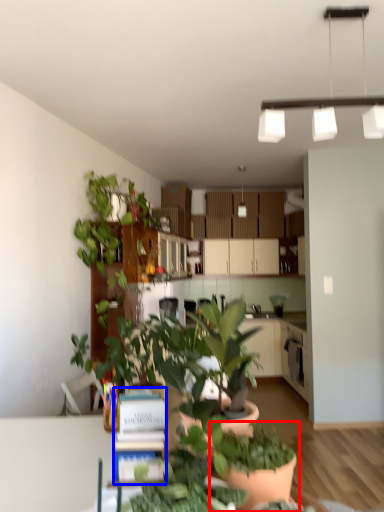
Question: Among these objects, which one is farthest to the camera, houseplant (highlighted by a red box) or book (highlighted by a blue box)?

Choices:
 (A) houseplant
 (B) book

Answer: (B)